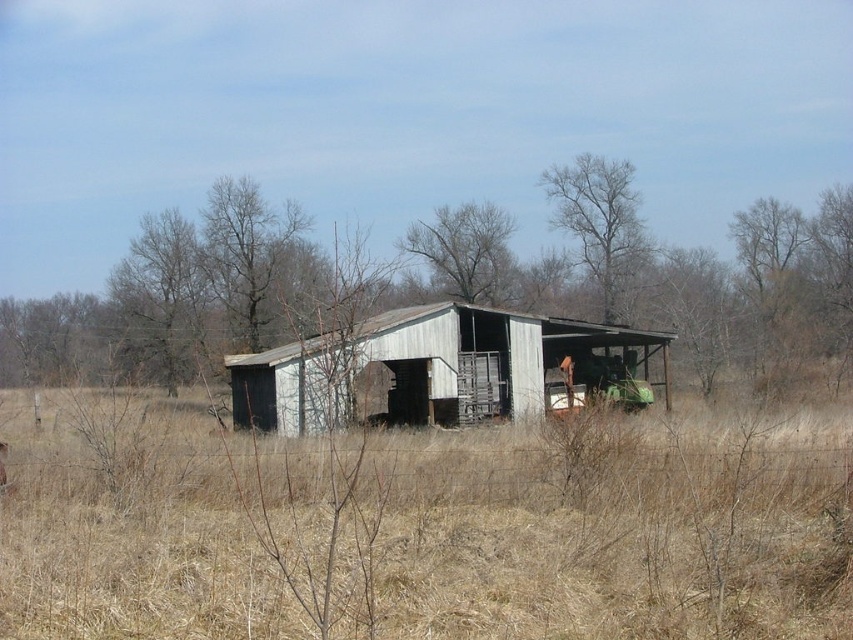
You are a farmer checking the field. You notice the brown dry grass at center and the white corrugated metal barn at center. Which one is wider in terms of their spread?

The brown dry grass at center is wider than the white corrugated metal barn at center according to the description.

You are standing in the middle of the field and see the brown dry grass at center and the white corrugated metal barn at center. Which object is positioned to the right side from your perspective?

The brown dry grass at center is to the right of the white corrugated metal barn at center, so the brown dry grass at center is positioned to the right side from your perspective.

You are standing at the origin point of the image coordinate system. You want to walk to the brown dry grass at center. What are the coordinates you need to move to?

The coordinates you need to move to are approximately 0.823 on the x axis and 0.498 on the y axis.